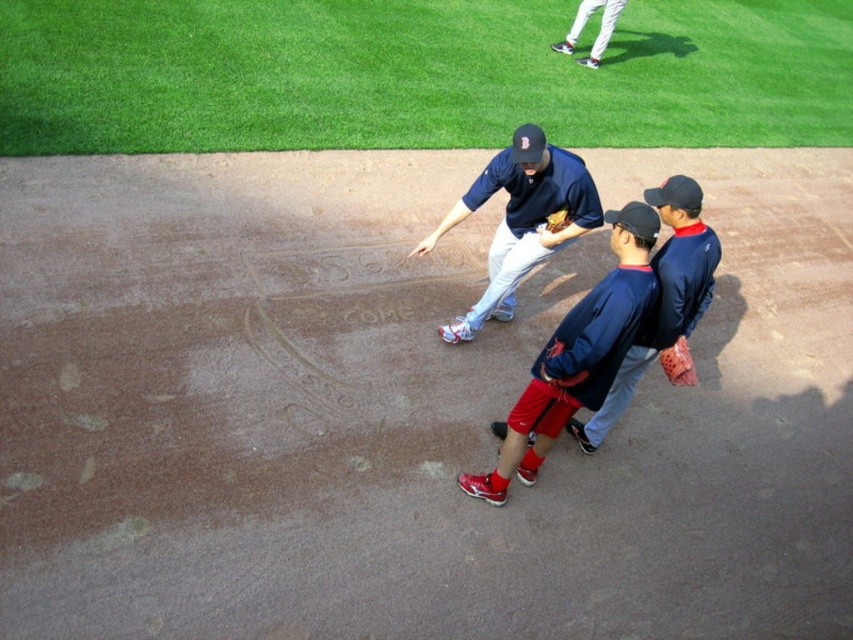
Question: Can you confirm if blue jersey at center is bigger than brown leather glove at center?

Choices:
 (A) no
 (B) yes

Answer: (B)

Question: Based on their relative distances, which object is nearer to the white baseball pants at upper center?

Choices:
 (A) matte blue baseball glove at center
 (B) orange leather glove at lower right
 (C) green grass at upper center
 (D) brown leather glove at center

Answer: (C)

Question: Which point is farther from the camera taking this photo?

Choices:
 (A) (589, 292)
 (B) (572, 193)
 (C) (550, 216)
 (D) (631, 360)

Answer: (C)

Question: Estimate the real-world distances between objects in this image. Which object is closer to the blue jersey at center?

Choices:
 (A) brown leather glove at center
 (B) matte blue baseball glove at center
 (C) orange leather glove at lower right

Answer: (C)

Question: Does green grass at upper center have a lesser width compared to brown leather glove at center?

Choices:
 (A) no
 (B) yes

Answer: (A)

Question: Is green grass at upper center below white baseball pants at upper center?

Choices:
 (A) no
 (B) yes

Answer: (A)